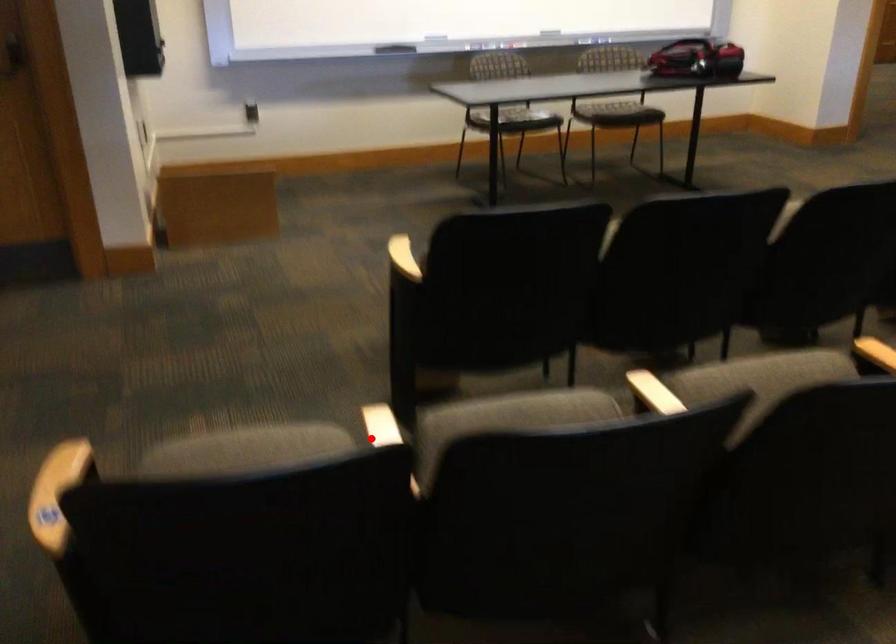
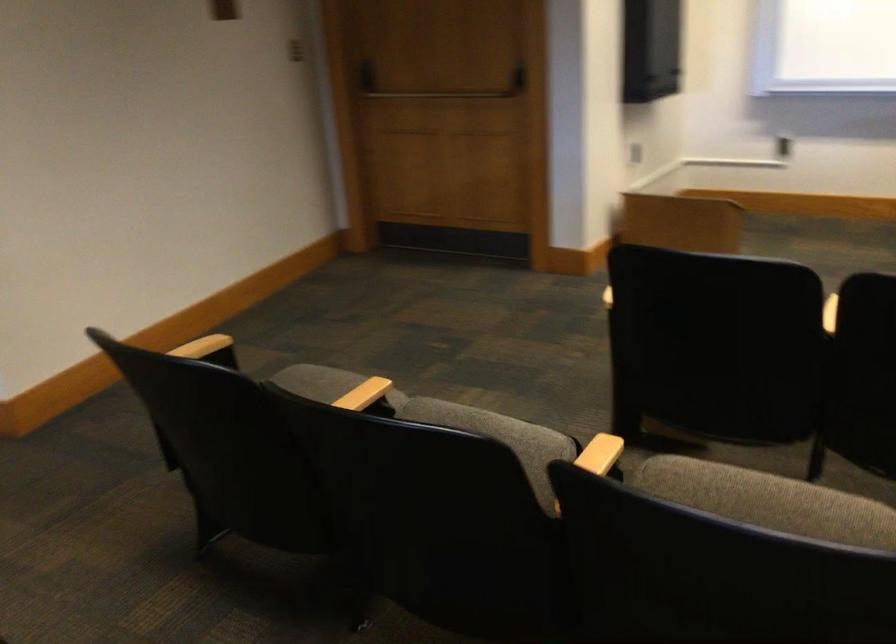
Question: A red point is marked in image1. In image2, is the corresponding 3D point closer to the camera or farther? Reply with the corresponding letter.

Choices:
 (A) The corresponding 3D point is closer.
 (B) The corresponding 3D point is farther.

Answer: (B)